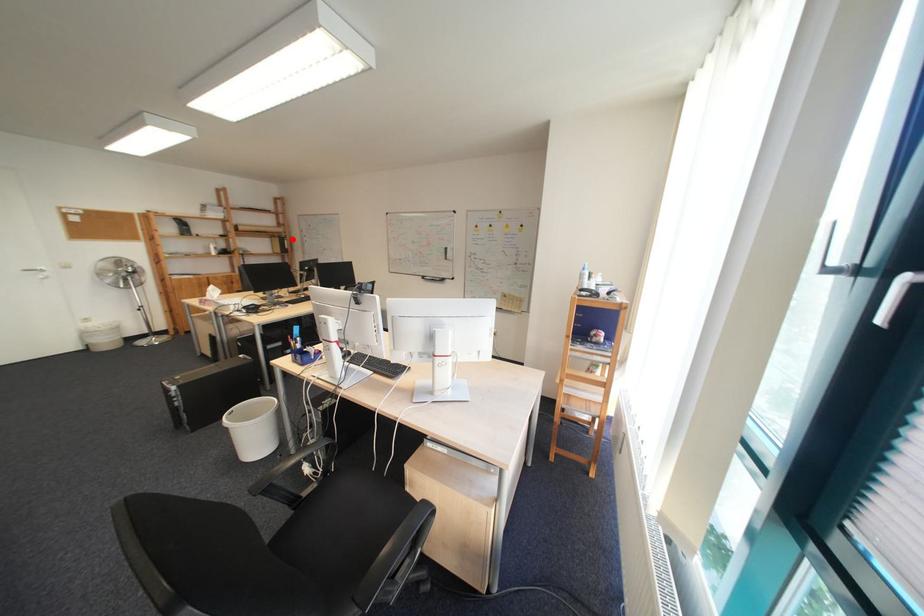
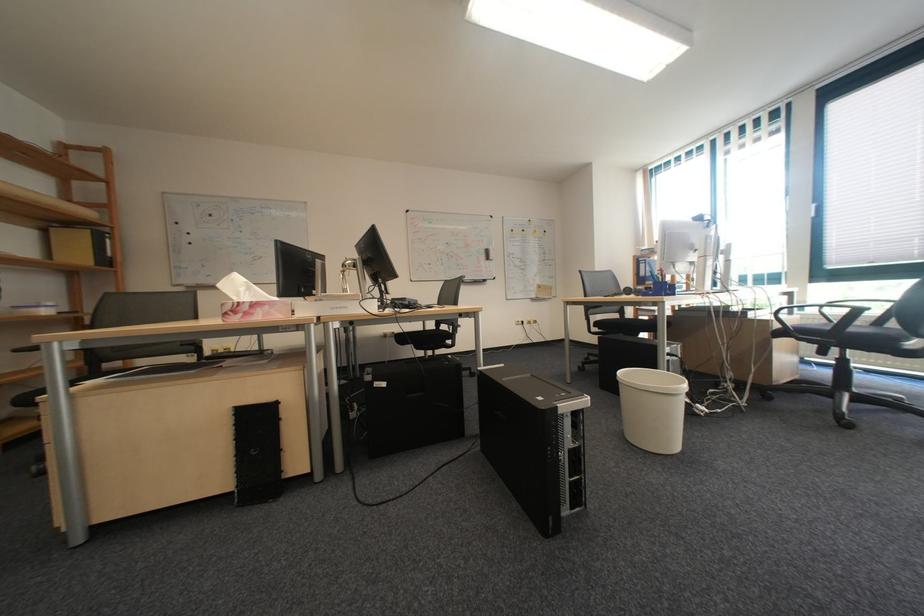
Question: I am providing you with two images of the same scene from different viewpoints. Image1 has a red point marked. In image2, the corresponding 3D location appears at what relative position? Reply with the corresponding letter.

Choices:
 (A) Closer
 (B) Farther

Answer: (B)